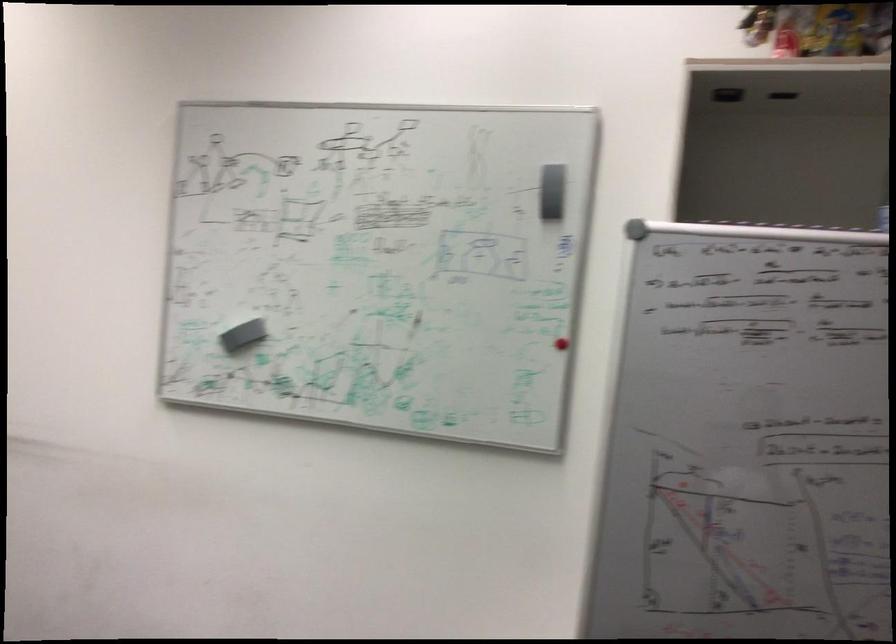
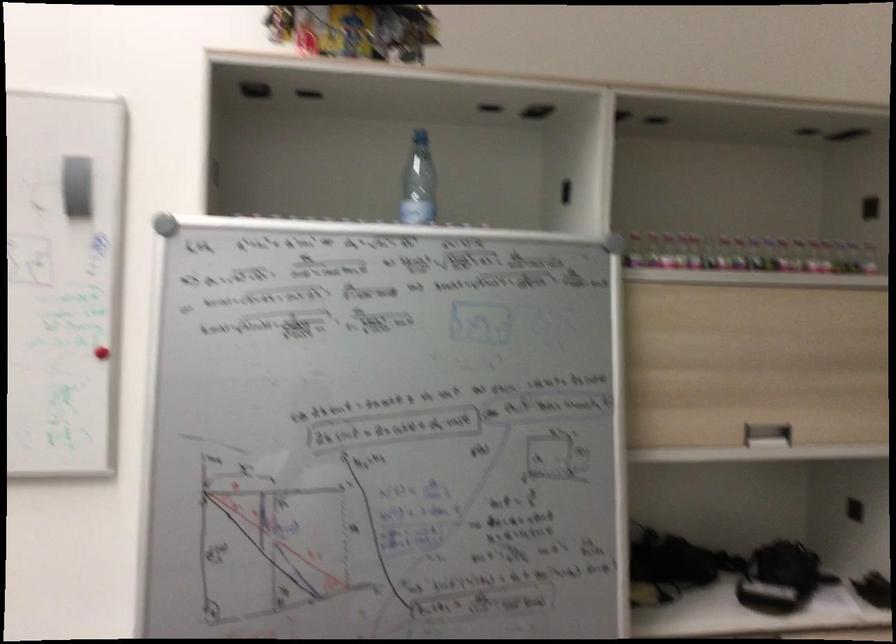
Question: Which direction would the cameraman need to move to produce the second image? Reply with the corresponding letter.

Choices:
 (A) Left
 (B) Right
 (C) Forward
 (D) Backward

Answer: (B)